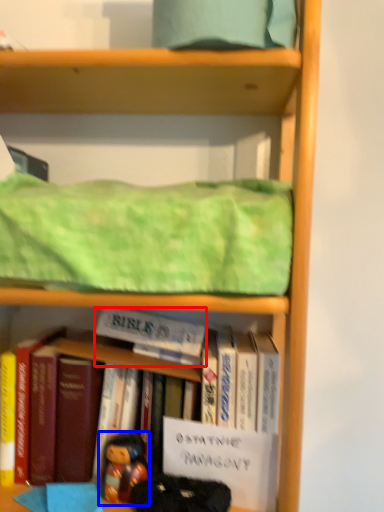
Question: Which point is further to the camera, paperback book (highlighted by a red box) or person (highlighted by a blue box)?

Choices:
 (A) paperback book
 (B) person

Answer: (A)